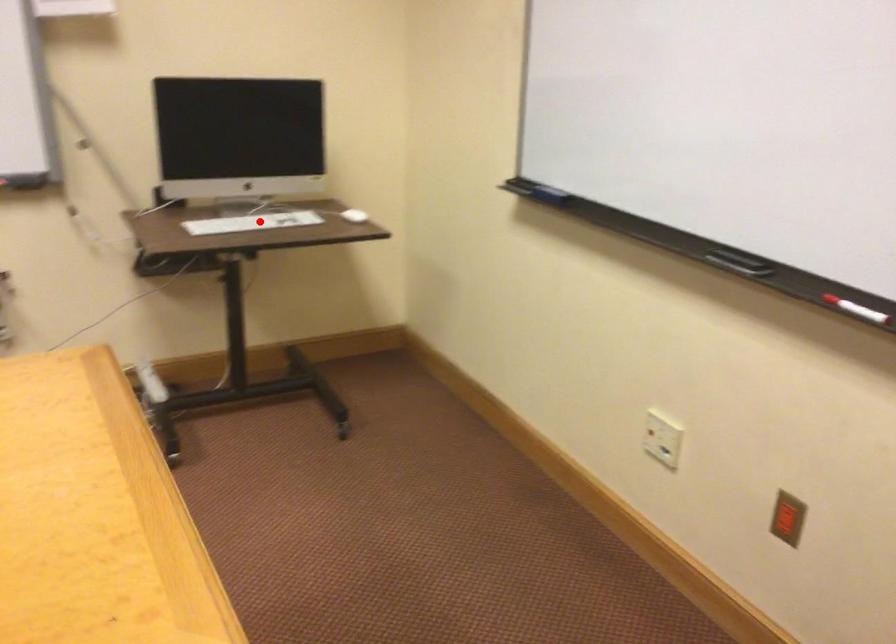
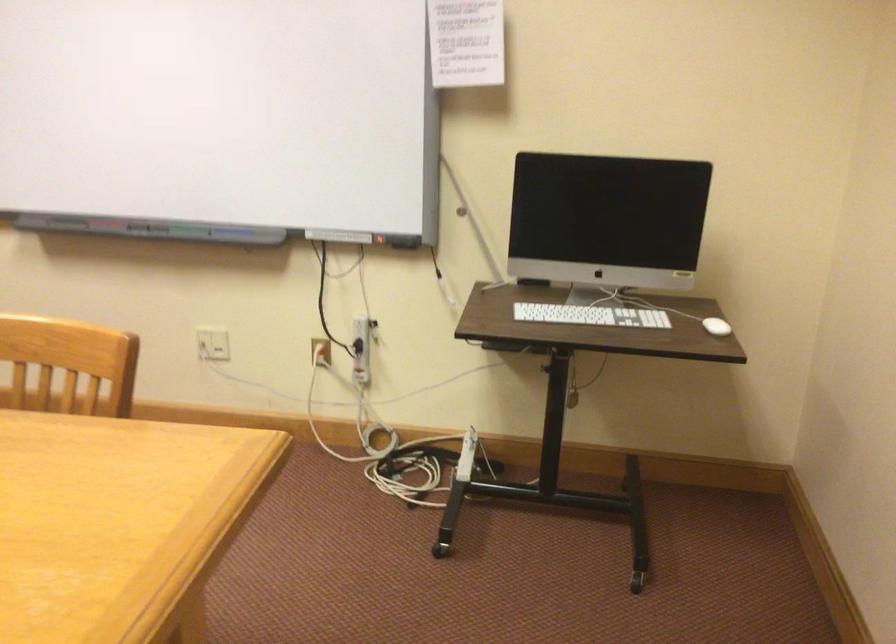
Question: I am providing you with two images of the same scene from different viewpoints. Image1 has a red point marked. In image2, the corresponding 3D location appears at what relative position? Reply with the corresponding letter.

Choices:
 (A) Closer
 (B) Farther

Answer: (A)